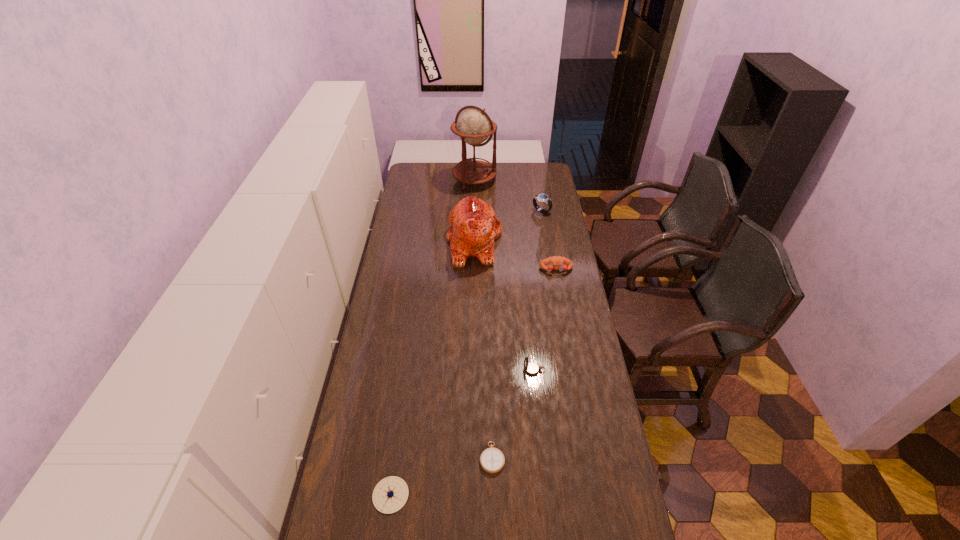
The height and width of the screenshot is (540, 960). In order to click on vacant space that's between the globe and the fifth object from left to right in this screenshot , I will do `click(504, 275)`.

I want to click on vacant space that is in between the tallest object and the watch, so click(508, 195).

This screenshot has width=960, height=540. I want to click on vacant area that lies between the cat and the sixth nearest object, so click(508, 226).

At what (x,y) coordinates should I click in order to perform the action: click on vacant area that lies between the second compass from right to left and the second farthest object. Please return your answer as a coordinate pair (x, y). This screenshot has height=540, width=960. Looking at the image, I should click on (516, 334).

Where is `vacant area that lies between the nearest object and the second compass from left to right`? This screenshot has height=540, width=960. vacant area that lies between the nearest object and the second compass from left to right is located at coordinates (442, 476).

The width and height of the screenshot is (960, 540). I want to click on unoccupied area between the second farthest object and the rightmost compass, so click(x=538, y=291).

Select which object appears as the second closest to the second farthest object. Please provide its 2D coordinates. Your answer should be formatted as a tuple, i.e. [(x, y)], where the tuple contains the x and y coordinates of a point satisfying the conditions above.

[(474, 126)]

Select which object appears as the sixth closest to the leftmost compass. Please provide its 2D coordinates. Your answer should be formatted as a tuple, i.e. [(x, y)], where the tuple contains the x and y coordinates of a point satisfying the conditions above.

[(474, 126)]

Identify the location of compass that is the third closest to the cat. This screenshot has width=960, height=540. (391, 493).

At what (x,y) coordinates should I click in order to perform the action: click on compass that is the second closest to the nearest compass. Please return your answer as a coordinate pair (x, y). This screenshot has height=540, width=960. Looking at the image, I should click on (531, 368).